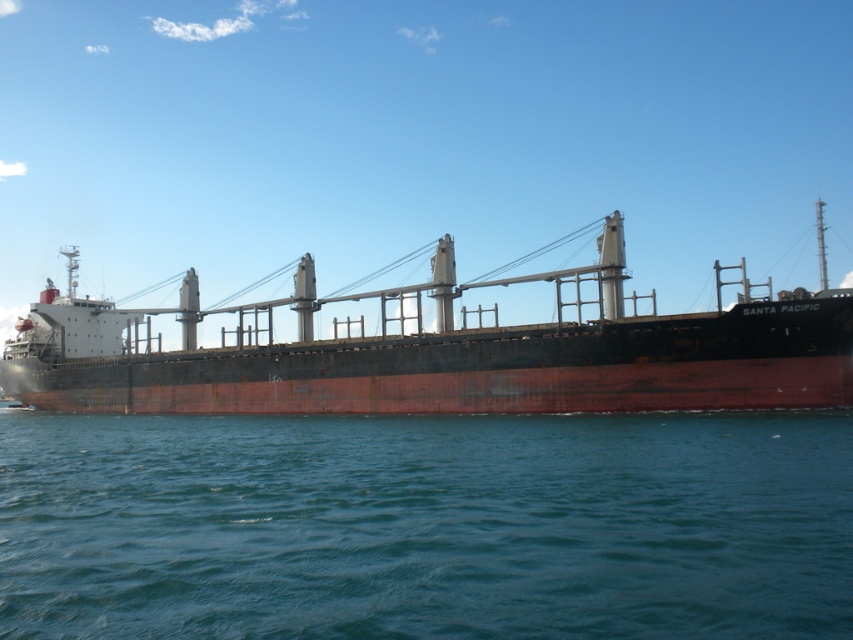
Does blue water at lower center have a lesser width compared to rusty metal ship at center?

Correct, blue water at lower center's width is less than rusty metal ship at center's.

Which is below, blue water at lower center or rusty metal ship at center?

blue water at lower center is below.

In order to click on blue water at lower center in this screenshot , I will do `click(426, 525)`.